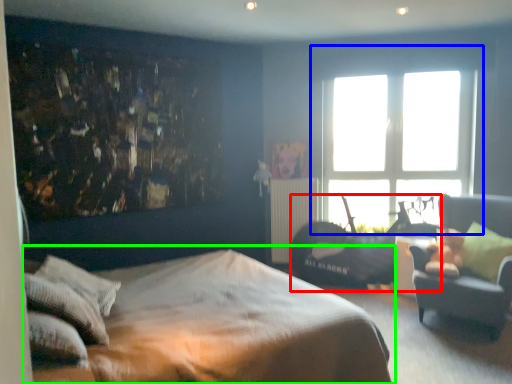
Question: Based on their relative distances, which object is farther from swivel chair (highlighted by a red box)? Choose from window (highlighted by a blue box) and bed (highlighted by a green box).

Choices:
 (A) window
 (B) bed

Answer: (B)